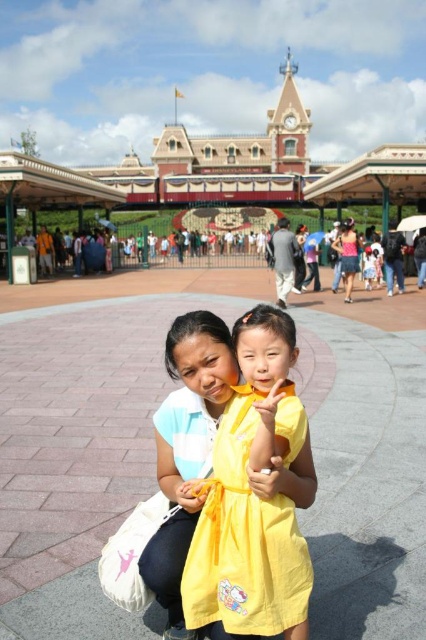
Question: Which object is the farthest from the pink fabric skirt at center?

Choices:
 (A) brick building at center
 (B) yellow cotton dress at center

Answer: (B)

Question: Based on their relative distances, which object is farther from the brick building at center?

Choices:
 (A) yellow cotton dress at center
 (B) pink fabric skirt at center

Answer: (A)

Question: In this image, where is yellow cotton dress at center located relative to pink fabric skirt at center?

Choices:
 (A) left
 (B) right

Answer: (A)

Question: Which of the following is the farthest from the observer?

Choices:
 (A) yellow cotton dress at center
 (B) brick building at center
 (C) pink fabric skirt at center

Answer: (C)

Question: Is brick building at center below yellow cotton dress at center?

Choices:
 (A) yes
 (B) no

Answer: (B)

Question: Does brick building at center have a larger size compared to yellow cotton dress at center?

Choices:
 (A) yes
 (B) no

Answer: (A)